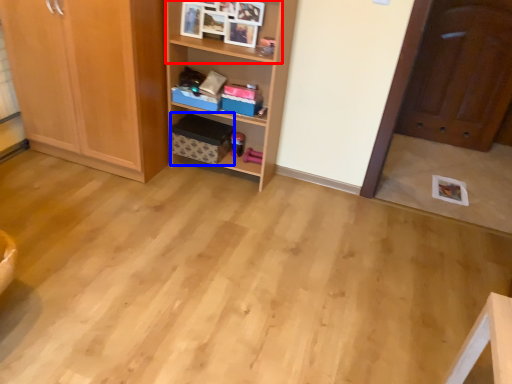
Question: Which point is closer to the camera, cabinet (highlighted by a red box) or cardboard box (highlighted by a blue box)?

Choices:
 (A) cabinet
 (B) cardboard box

Answer: (A)